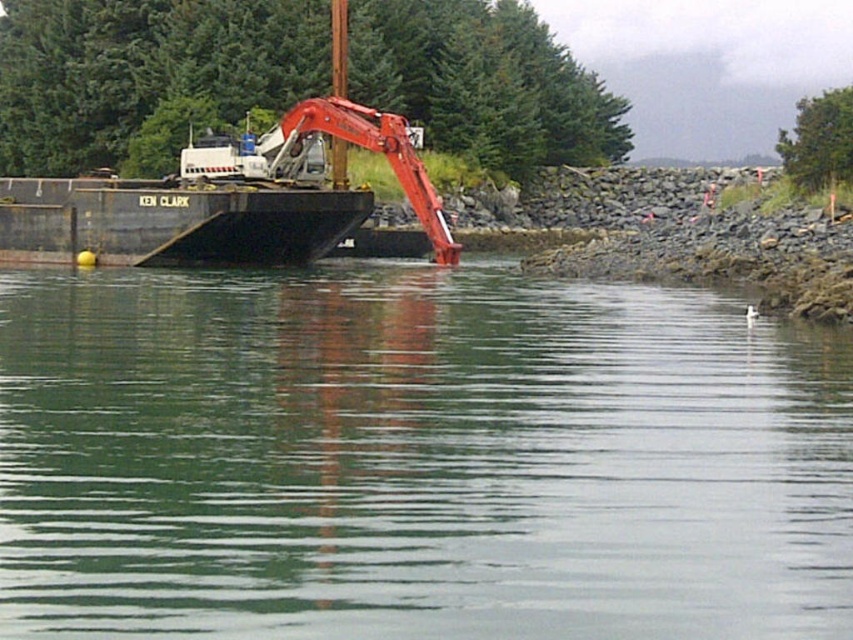
Question: Which of the following is the closest to the observer?

Choices:
 (A) green smooth water at center
 (B) matte red excavator at center

Answer: (A)

Question: Does green smooth water at center have a greater width compared to matte red excavator at center?

Choices:
 (A) no
 (B) yes

Answer: (B)

Question: Does green smooth water at center appear on the right side of matte red excavator at center?

Choices:
 (A) no
 (B) yes

Answer: (B)

Question: Which point is farther from the camera taking this photo?

Choices:
 (A) (148, 532)
 (B) (338, 97)

Answer: (B)

Question: Can you confirm if green smooth water at center is thinner than matte red excavator at center?

Choices:
 (A) no
 (B) yes

Answer: (A)

Question: Which point appears farthest from the camera in this image?

Choices:
 (A) (364, 394)
 (B) (376, 128)

Answer: (B)